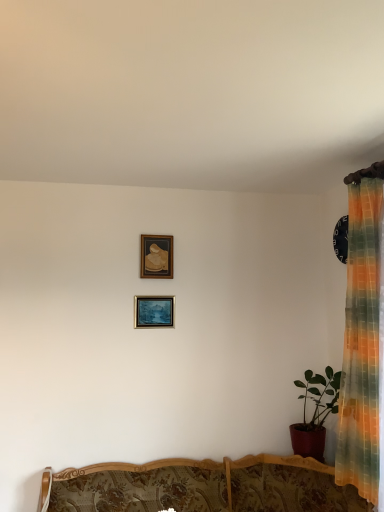
Describe the element at coordinates (201, 486) in the screenshot. The height and width of the screenshot is (512, 384). I see `wooden floral-patterned sofa at center` at that location.

Image resolution: width=384 pixels, height=512 pixels. Identify the location of wooden picture frame at upper center, arranged as the 2th picture frame when ordered from the bottom. (156, 256).

The height and width of the screenshot is (512, 384). What are the coordinates of `matte red pot at right` in the screenshot? It's located at (x=315, y=413).

Is matte wooden picture frame at center, marked as the second picture frame in a top-to-bottom arrangement, located outside wooden floral-patterned sofa at center?

Yes.

Is matte wooden picture frame at center, the 1th picture frame from the bottom, taller or shorter than wooden floral-patterned sofa at center?

In the image, matte wooden picture frame at center, the 1th picture frame from the bottom, appears to be shorter than wooden floral-patterned sofa at center.

Which is behind, point (167, 301) or point (40, 497)?

The point (167, 301) is more distant.

Identify the location of furniture below the matte wooden picture frame at center, marked as the second picture frame in a top-to-bottom arrangement (from a real-world perspective). (201, 486).

Is matte wooden picture frame at center, the 1th picture frame from the bottom, turned away from matte red pot at right?

No, matte red pot at right is not at the back of matte wooden picture frame at center, the 1th picture frame from the bottom.

Does matte wooden picture frame at center, marked as the second picture frame in a top-to-bottom arrangement, come behind matte red pot at right?

Yes, it is.

How distant is matte wooden picture frame at center, marked as the second picture frame in a top-to-bottom arrangement, from matte red pot at right?

They are 1.07 meters apart.

Is matte wooden picture frame at center, the 1th picture frame from the bottom, taller than matte red pot at right?

No.

From the image's perspective, which one is positioned higher, wooden picture frame at upper center, arranged as the first picture frame when viewed from the top, or wooden floral-patterned sofa at center?

From the image's view, wooden picture frame at upper center, arranged as the first picture frame when viewed from the top, is above.

Considering the positions of points (165, 262) and (138, 505), is point (165, 262) closer to camera compared to point (138, 505)?

No.

Is wooden picture frame at upper center, arranged as the 2th picture frame when ordered from the bottom, outside of wooden floral-patterned sofa at center?

Yes, wooden picture frame at upper center, arranged as the 2th picture frame when ordered from the bottom, is outside of wooden floral-patterned sofa at center.

Is wooden picture frame at upper center, arranged as the 2th picture frame when ordered from the bottom, further to camera compared to matte wooden picture frame at center, marked as the second picture frame in a top-to-bottom arrangement?

Yes, it is.

Which object is positioned more to the left, wooden picture frame at upper center, arranged as the 2th picture frame when ordered from the bottom, or matte wooden picture frame at center, the 1th picture frame from the bottom?

From the viewer's perspective, matte wooden picture frame at center, the 1th picture frame from the bottom, appears more on the left side.

Is point (152, 260) closer to camera compared to point (160, 325)?

No.

Considering the relative sizes of wooden picture frame at upper center, arranged as the 2th picture frame when ordered from the bottom, and matte wooden picture frame at center, the 1th picture frame from the bottom, in the image provided, is wooden picture frame at upper center, arranged as the 2th picture frame when ordered from the bottom, wider than matte wooden picture frame at center, the 1th picture frame from the bottom,?

In fact, wooden picture frame at upper center, arranged as the 2th picture frame when ordered from the bottom, might be narrower than matte wooden picture frame at center, the 1th picture frame from the bottom.

Which of these two, matte wooden picture frame at center, marked as the second picture frame in a top-to-bottom arrangement, or wooden picture frame at upper center, arranged as the 2th picture frame when ordered from the bottom, is wider?

Wider between the two is matte wooden picture frame at center, marked as the second picture frame in a top-to-bottom arrangement.

From the image's perspective, which object appears higher, matte wooden picture frame at center, the 1th picture frame from the bottom, or wooden picture frame at upper center, arranged as the 2th picture frame when ordered from the bottom?

wooden picture frame at upper center, arranged as the 2th picture frame when ordered from the bottom, appears higher in the image.

Is wooden picture frame at upper center, arranged as the first picture frame when viewed from the top, at the back of matte wooden picture frame at center, marked as the second picture frame in a top-to-bottom arrangement?

matte wooden picture frame at center, marked as the second picture frame in a top-to-bottom arrangement, does not have its back to wooden picture frame at upper center, arranged as the first picture frame when viewed from the top.

Which is more to the left, matte wooden picture frame at center, marked as the second picture frame in a top-to-bottom arrangement, or wooden picture frame at upper center, arranged as the first picture frame when viewed from the top?

matte wooden picture frame at center, marked as the second picture frame in a top-to-bottom arrangement.

From the image's perspective, is matte red pot at right beneath matte wooden picture frame at center, marked as the second picture frame in a top-to-bottom arrangement?

Yes, from the image's perspective, matte red pot at right is beneath matte wooden picture frame at center, marked as the second picture frame in a top-to-bottom arrangement.

How different are the orientations of matte red pot at right and matte wooden picture frame at center, marked as the second picture frame in a top-to-bottom arrangement, in degrees?

They differ by 90.2 degrees in their facing directions.

Where is `the 1st picture frame positioned above the matte red pot at right (from a real-world perspective)`? the 1st picture frame positioned above the matte red pot at right (from a real-world perspective) is located at coordinates (154, 311).

Are matte red pot at right and matte wooden picture frame at center, the 1th picture frame from the bottom, making contact?

No.

In the scene shown: Is matte red pot at right positioned beyond the bounds of wooden floral-patterned sofa at center?

matte red pot at right is positioned outside wooden floral-patterned sofa at center.

Looking at this image, is matte red pot at right positioned with its back to wooden floral-patterned sofa at center?

That's not correct — matte red pot at right is not looking away from wooden floral-patterned sofa at center.

Is matte red pot at right bigger or smaller than wooden floral-patterned sofa at center?

In the image, matte red pot at right appears to be smaller than wooden floral-patterned sofa at center.

From the image's perspective, which is above, matte red pot at right or wooden floral-patterned sofa at center?

matte red pot at right appears higher in the image.

Locate an element on the screen. The image size is (384, 512). furniture located below the matte wooden picture frame at center, the 1th picture frame from the bottom (from the image's perspective) is located at coordinates (201, 486).

This screenshot has height=512, width=384. I want to click on picture frame that is the 1st object located behind the matte red pot at right, so click(154, 311).

Looking at the image, which one is located closer to matte wooden picture frame at center, marked as the second picture frame in a top-to-bottom arrangement, matte red pot at right or wooden picture frame at upper center, arranged as the first picture frame when viewed from the top?

wooden picture frame at upper center, arranged as the first picture frame when viewed from the top.

From the image, which object appears to be nearer to matte red pot at right, matte wooden picture frame at center, the 1th picture frame from the bottom, or wooden floral-patterned sofa at center?

Based on the image, wooden floral-patterned sofa at center appears to be nearer to matte red pot at right.

When comparing their distances from matte red pot at right, does wooden picture frame at upper center, arranged as the first picture frame when viewed from the top, or matte wooden picture frame at center, marked as the second picture frame in a top-to-bottom arrangement, seem closer?

Among the two, matte wooden picture frame at center, marked as the second picture frame in a top-to-bottom arrangement, is located nearer to matte red pot at right.

When comparing their distances from wooden picture frame at upper center, arranged as the first picture frame when viewed from the top, does wooden floral-patterned sofa at center or matte red pot at right seem further?

Based on the image, wooden floral-patterned sofa at center appears to be further to wooden picture frame at upper center, arranged as the first picture frame when viewed from the top.

Considering their positions, is matte wooden picture frame at center, the 1th picture frame from the bottom, positioned closer to matte red pot at right than wooden picture frame at upper center, arranged as the 2th picture frame when ordered from the bottom?

Based on the image, matte wooden picture frame at center, the 1th picture frame from the bottom, appears to be nearer to matte red pot at right.

When comparing their distances from wooden floral-patterned sofa at center, does wooden picture frame at upper center, arranged as the 2th picture frame when ordered from the bottom, or matte wooden picture frame at center, marked as the second picture frame in a top-to-bottom arrangement, seem closer?

matte wooden picture frame at center, marked as the second picture frame in a top-to-bottom arrangement, is positioned closer to the anchor wooden floral-patterned sofa at center.

Based on the photo, from the image, which object appears to be nearer to wooden picture frame at upper center, arranged as the first picture frame when viewed from the top, matte red pot at right or wooden floral-patterned sofa at center?

Among the two, matte red pot at right is located nearer to wooden picture frame at upper center, arranged as the first picture frame when viewed from the top.

When comparing their distances from wooden picture frame at upper center, arranged as the 2th picture frame when ordered from the bottom, does wooden floral-patterned sofa at center or matte wooden picture frame at center, marked as the second picture frame in a top-to-bottom arrangement, seem closer?

matte wooden picture frame at center, marked as the second picture frame in a top-to-bottom arrangement, lies closer to wooden picture frame at upper center, arranged as the 2th picture frame when ordered from the bottom, than the other object.

Where is `picture frame between wooden picture frame at upper center, arranged as the 2th picture frame when ordered from the bottom, and wooden floral-patterned sofa at center in the up-down direction`? This screenshot has height=512, width=384. picture frame between wooden picture frame at upper center, arranged as the 2th picture frame when ordered from the bottom, and wooden floral-patterned sofa at center in the up-down direction is located at coordinates (154, 311).

Identify the location of furniture situated between matte wooden picture frame at center, the 1th picture frame from the bottom, and matte red pot at right from left to right. The image size is (384, 512). (201, 486).

The image size is (384, 512). Identify the location of picture frame between matte wooden picture frame at center, the 1th picture frame from the bottom, and matte red pot at right, in the horizontal direction. (156, 256).

The image size is (384, 512). In order to click on houseplant between wooden picture frame at upper center, arranged as the first picture frame when viewed from the top, and wooden floral-patterned sofa at center from top to bottom in this screenshot , I will do `click(315, 413)`.